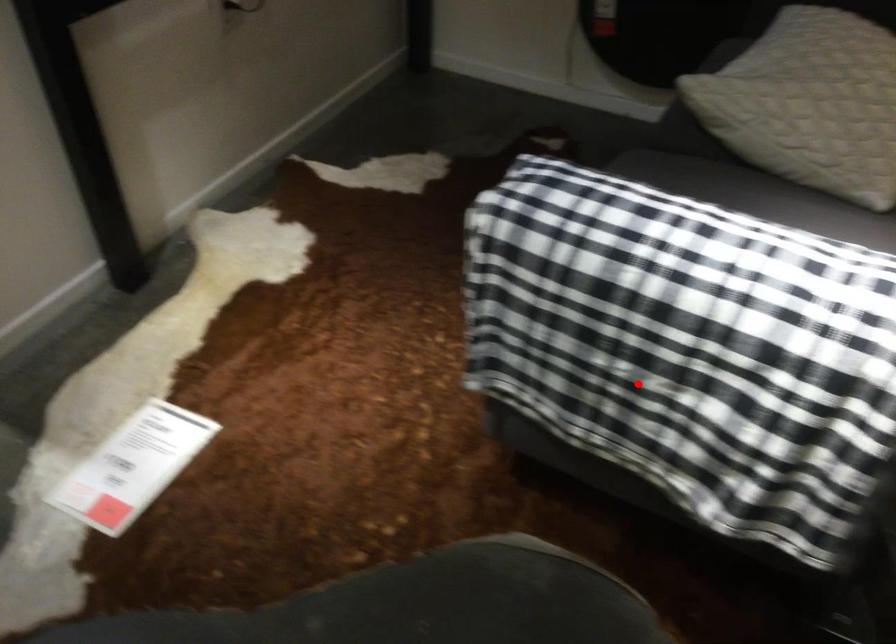
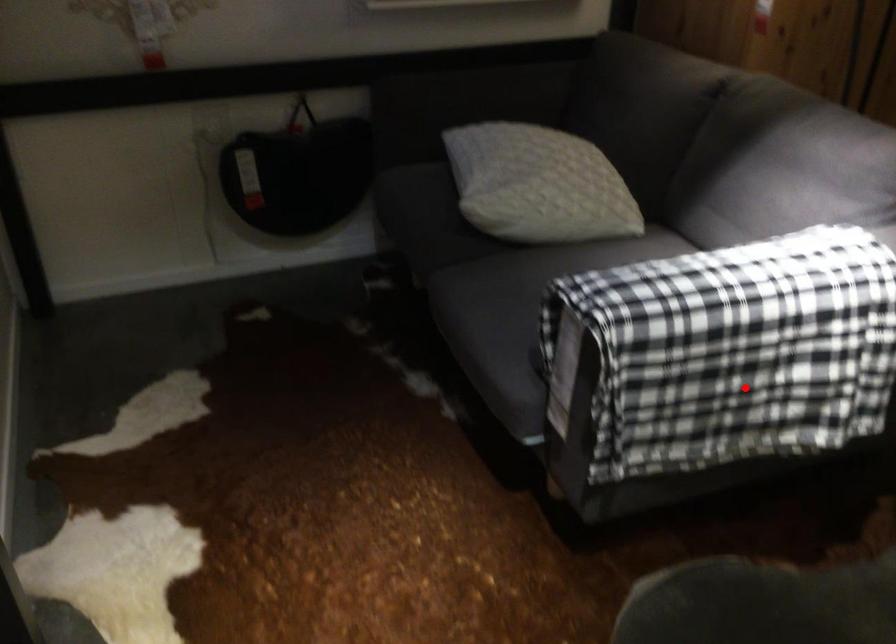
I am providing you with two images of the same scene from different viewpoints. A red point is marked on the first image and another point is marked on the second image. Is the red point in image1 aligned with the point shown in image2?

Yes